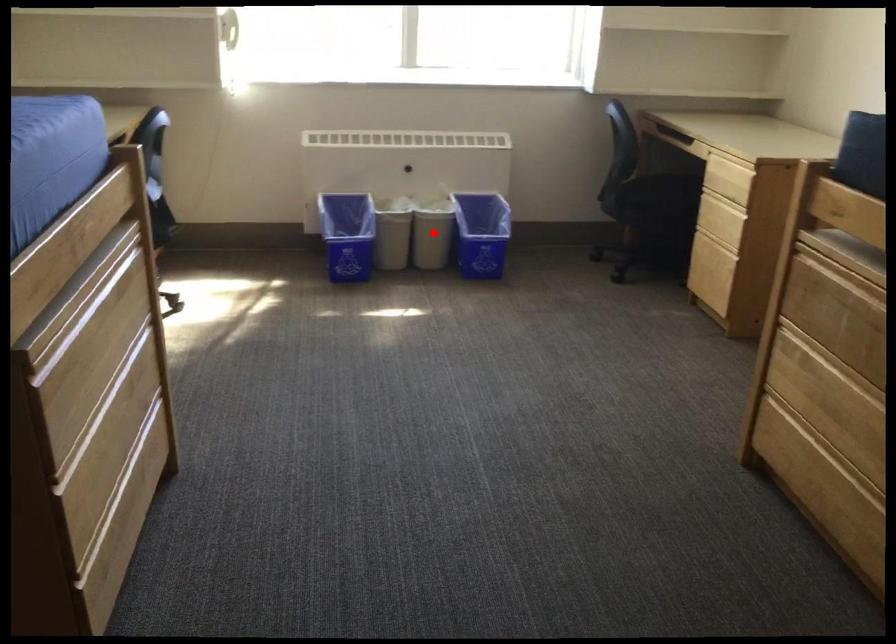
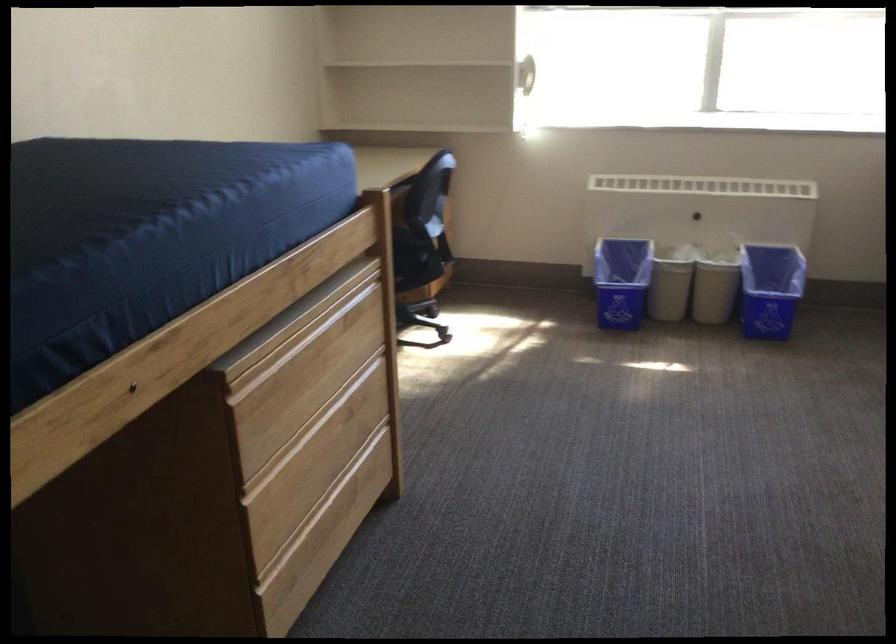
The point at the highlighted location is marked in the first image. Where is the corresponding point in the second image?

(714, 285)